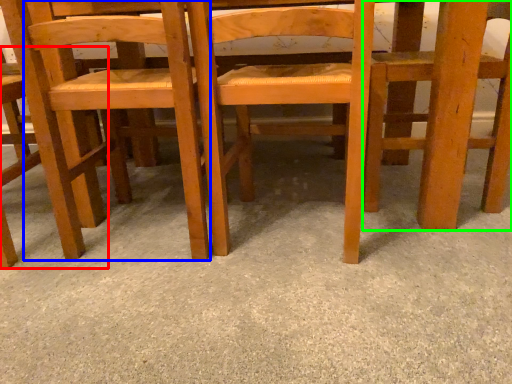
Question: Considering the real-world distances, which object is closest to chair (highlighted by a red box)? chair (highlighted by a blue box) or chair (highlighted by a green box).

Choices:
 (A) chair
 (B) chair

Answer: (A)